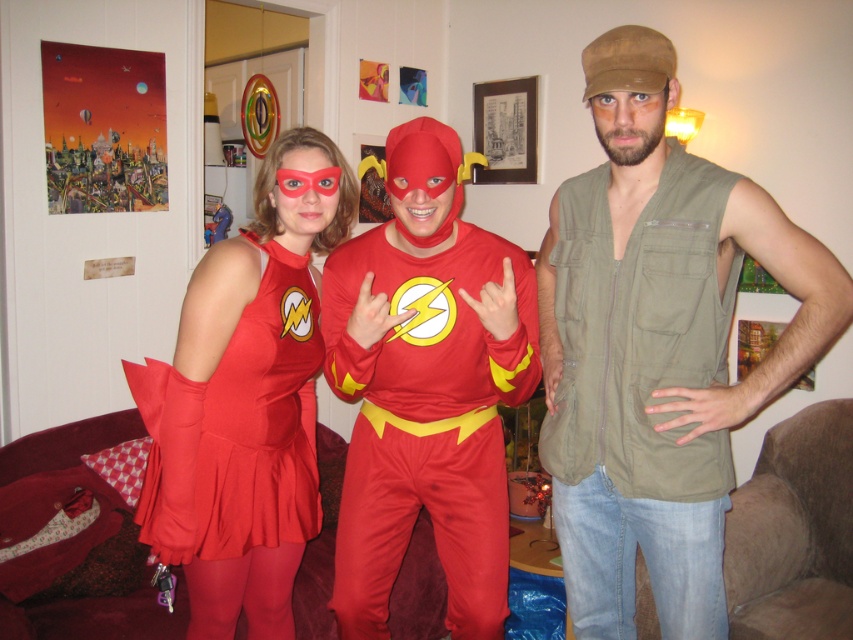
You are a photographer trying to capture the best shot of the two points in the scene. Since you want to ensure both points are visible in the frame, can you determine if the point at position (200, 378) is closer to the camera than the point at (84, 163)?

Point (200, 378) is in front of point (84, 163), so yes, it is closer to the camera and both points will be visible in the frame.

You are standing in front of a group of costumed individuals. You notice a matte red dress at center and a shiny spandex suit at center. Which one is closer to you?

The matte red dress at center is closer to you because it is further to the viewer than the shiny spandex suit at center.

You are planning to wear either the matte red dress at center or the shiny spandex suit at center for a costume party. Based on the image, which one do you think would be more comfortable for moving around freely?

The shiny spandex suit at center is likely more comfortable for moving around freely since it is narrower than the matte red dress at center, allowing for greater ease of movement.